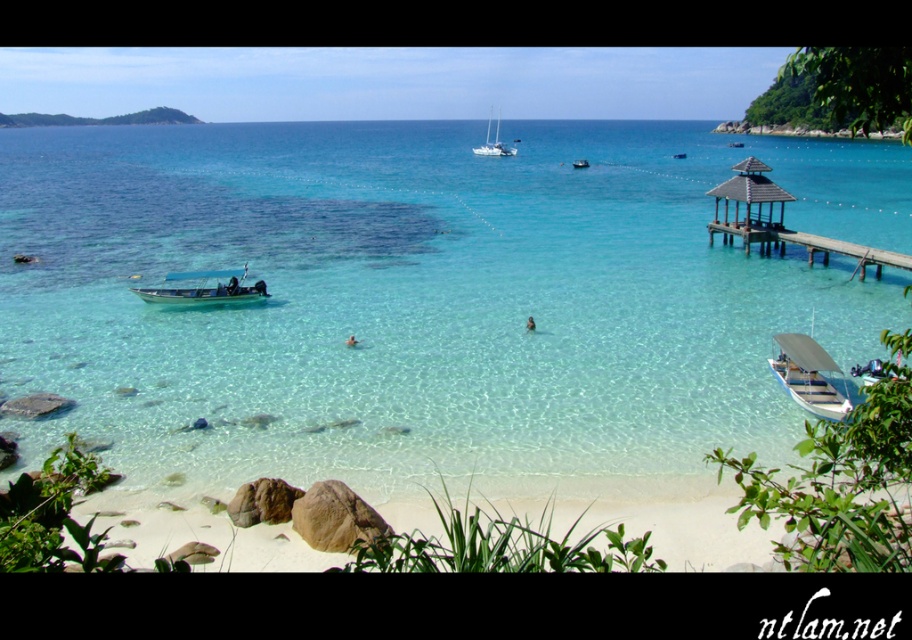
Question: Among these objects, which one is farthest from the camera?

Choices:
 (A) metallic blue boat at lower left
 (B) white glossy sailboat at upper center
 (C) wooden gazebo at center-right
 (D) brown wooden pier at upper right

Answer: (B)

Question: Which of these objects is positioned closest to the metallic blue boat at lower left?

Choices:
 (A) wooden gazebo at center-right
 (B) brown wooden pier at upper right
 (C) clear crystal water at center
 (D) white wooden boat at lower right

Answer: (D)

Question: Is white wooden boat at lower right above wooden gazebo at center-right?

Choices:
 (A) no
 (B) yes

Answer: (A)

Question: Is brown wooden pier at upper right thinner than metallic blue boat at lower left?

Choices:
 (A) yes
 (B) no

Answer: (B)

Question: Is brown wooden pier at upper right closer to camera compared to white wooden boat at lower right?

Choices:
 (A) yes
 (B) no

Answer: (B)

Question: Among these objects, which one is nearest to the camera?

Choices:
 (A) clear crystal water at center
 (B) wooden gazebo at center-right

Answer: (A)